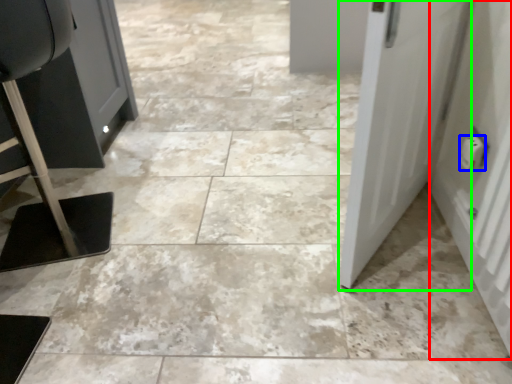
Question: Considering the real-world distances, which object is farthest from door (highlighted by a red box)? electric outlet (highlighted by a blue box) or door (highlighted by a green box)?

Choices:
 (A) electric outlet
 (B) door

Answer: (B)